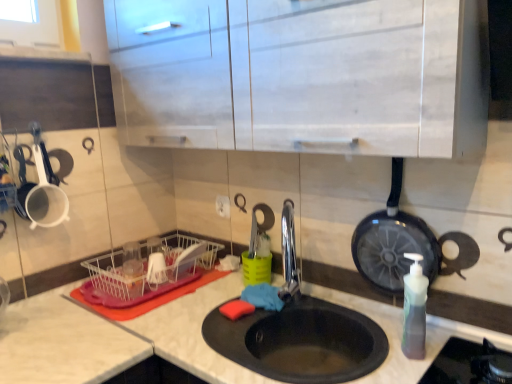
Question: Would you say black non-stick frying pan at right contains black matte sink at center?

Choices:
 (A) yes
 (B) no

Answer: (B)

Question: Does black non-stick frying pan at right have a greater width compared to black matte sink at center?

Choices:
 (A) yes
 (B) no

Answer: (B)

Question: From a real-world perspective, is black non-stick frying pan at right over black matte sink at center?

Choices:
 (A) yes
 (B) no

Answer: (A)

Question: Is black non-stick frying pan at right facing towards black matte sink at center?

Choices:
 (A) yes
 (B) no

Answer: (B)

Question: Is black non-stick frying pan at right shorter than black matte sink at center?

Choices:
 (A) no
 (B) yes

Answer: (A)

Question: From a real-world perspective, is black non-stick frying pan at right above or below translucent plastic soap dispenser at right?

Choices:
 (A) above
 (B) below

Answer: (A)

Question: In the image, is black non-stick frying pan at right on the left side or the right side of translucent plastic soap dispenser at right?

Choices:
 (A) left
 (B) right

Answer: (B)

Question: Choose the correct answer: Is black non-stick frying pan at right inside translucent plastic soap dispenser at right or outside it?

Choices:
 (A) outside
 (B) inside

Answer: (A)

Question: Looking at their shapes, would you say black non-stick frying pan at right is wider or thinner than translucent plastic soap dispenser at right?

Choices:
 (A) wide
 (B) thin

Answer: (B)

Question: Is black non-stick frying pan at right inside or outside of clear plastic dish rack at lower left?

Choices:
 (A) inside
 (B) outside

Answer: (B)

Question: Would you say black non-stick frying pan at right is to the left or to the right of clear plastic dish rack at lower left in the picture?

Choices:
 (A) left
 (B) right

Answer: (B)

Question: Considering the positions of black non-stick frying pan at right and clear plastic dish rack at lower left in the image, is black non-stick frying pan at right bigger or smaller than clear plastic dish rack at lower left?

Choices:
 (A) big
 (B) small

Answer: (B)

Question: In terms of height, does black non-stick frying pan at right look taller or shorter compared to clear plastic dish rack at lower left?

Choices:
 (A) short
 (B) tall

Answer: (B)

Question: Relative to clear plastic dish rack at lower left, is polished chrome faucet at center in front or behind?

Choices:
 (A) behind
 (B) front

Answer: (B)

Question: Is polished chrome faucet at center wider or thinner than clear plastic dish rack at lower left?

Choices:
 (A) thin
 (B) wide

Answer: (A)